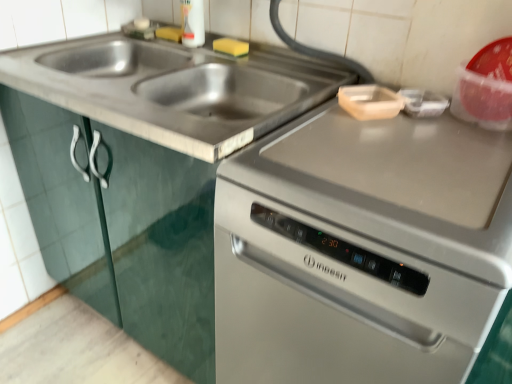
In order to click on free space in front of wooden cutting board at upper right in this screenshot , I will do 386,144.